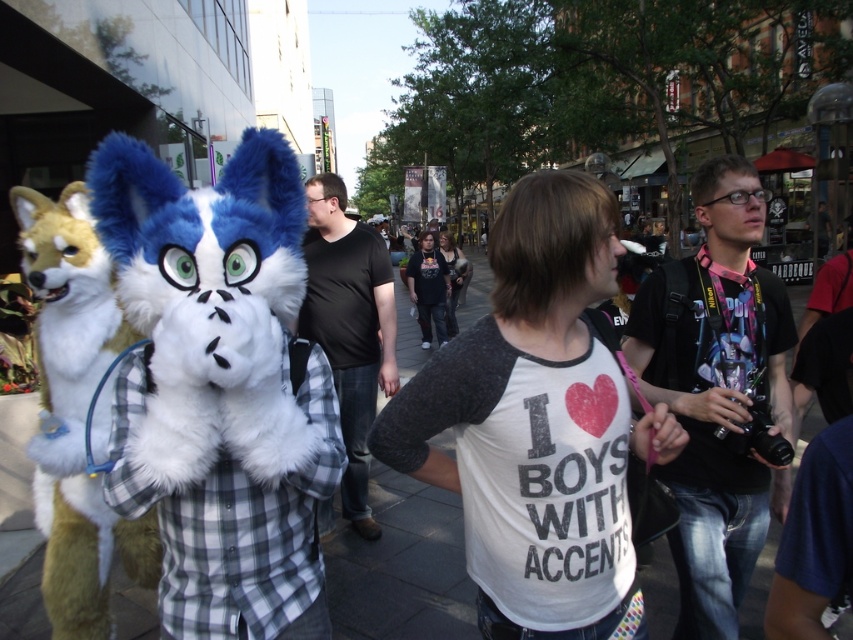
You are a photographer standing in the middle of the street. You want to take a photo of the black matte shirt at center without moving your position. Can you focus on it clearly?

The black matte shirt at center is 2.55 meters away from viewer, so yes, you can focus on it clearly since it is within a typical camera lens focusing range.

You are standing in the middle of the street and see the point marked at coordinates (x=76, y=413). Which object in the scene is this point located on?

The point at coordinates (x=76, y=413) is located on the fluffy white fox at left.